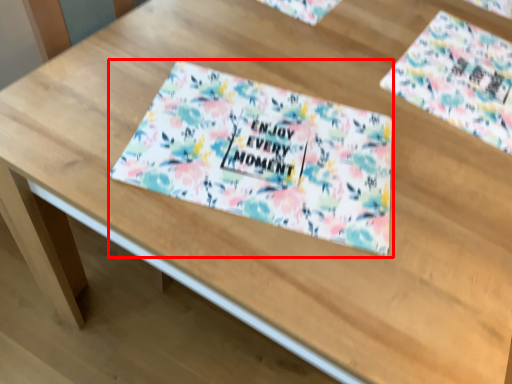
Question: Observing the image, what is the correct spatial positioning of tablecloth (annotated by the red box) in reference to flyer?

Choices:
 (A) right
 (B) left

Answer: (B)